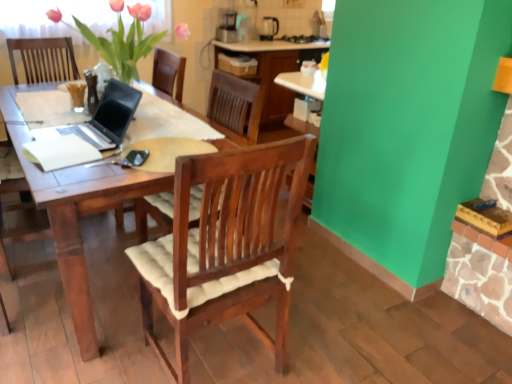
Question: Relative to pink matte vase at upper left, is white paper at center in front or behind?

Choices:
 (A) behind
 (B) front

Answer: (B)

Question: Is white paper at center taller or shorter than pink matte vase at upper left?

Choices:
 (A) short
 (B) tall

Answer: (A)

Question: Considering the real-world distances, which object is farthest from the pink matte vase at upper left?

Choices:
 (A) matte black coffee maker at upper center
 (B) matte black laptop at left
 (C) white paper at center
 (D) wooden laptop at left

Answer: (A)

Question: Considering the real-world distances, which object is closest to the pink matte vase at upper left?

Choices:
 (A) white paper at center
 (B) matte black coffee maker at upper center
 (C) wooden laptop at left
 (D) matte black laptop at left

Answer: (D)